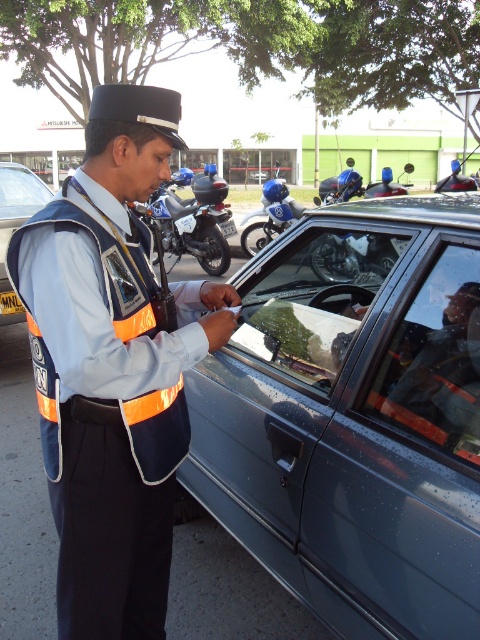
Question: Is orange reflective vest at center above transparent glass windshield at center?

Choices:
 (A) no
 (B) yes

Answer: (A)

Question: Which object is positioned closest to the matte black car at center?

Choices:
 (A) blue glossy motorcycle at center
 (B) metallic gray car at center
 (C) orange reflective vest at center

Answer: (C)

Question: Does blue glossy motorcycle at center appear under matte black car at center?

Choices:
 (A) yes
 (B) no

Answer: (B)

Question: Which object is farther from the camera taking this photo?

Choices:
 (A) transparent glass windshield at center
 (B) blue glossy helmet at center

Answer: (B)

Question: Can you confirm if transparent glass windshield at center is positioned below blue glossy helmet at center?

Choices:
 (A) yes
 (B) no

Answer: (A)

Question: Which object is positioned farthest from the orange reflective vest at center?

Choices:
 (A) blue glossy motorcycle at center
 (B) blue glossy helmet at center
 (C) matte black car at center

Answer: (B)